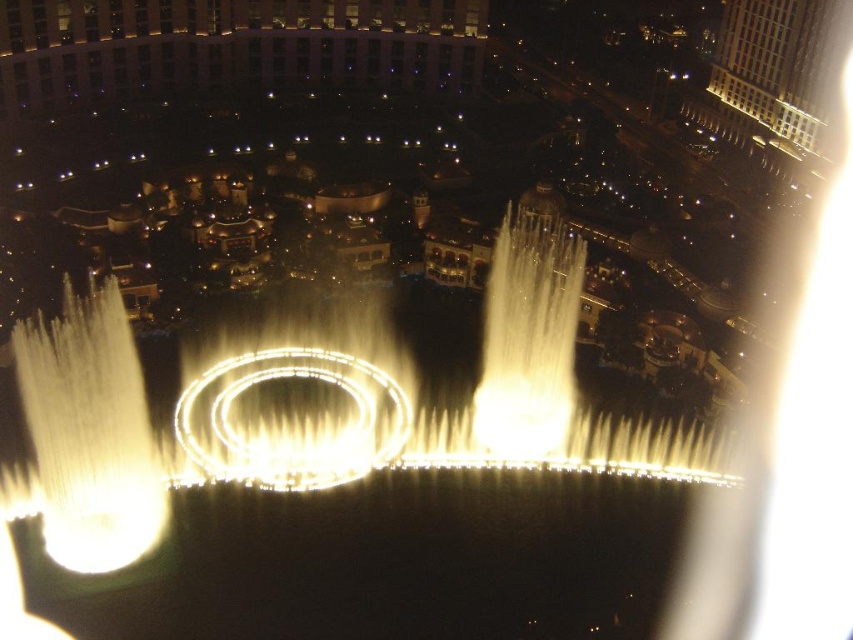
You are standing at the base of the fountain and want to take a photo of the white marble building at upper right without the beige stone building at upper center blocking the view. Is this possible?

The white marble building at upper right is behind the beige stone building at upper center, so it will be blocked by the beige stone building at upper center. You will not be able to take a clear photo of the white marble building at upper right without the beige stone building at upper center blocking the view.

You are standing at the fountain and want to walk towards the beige stone building at upper center and the white marble building at upper right. Which building should you head towards if you want to go to the one that is on the left side of the other?

You should head towards the beige stone building at upper center because it is to the left of the white marble building at upper right.